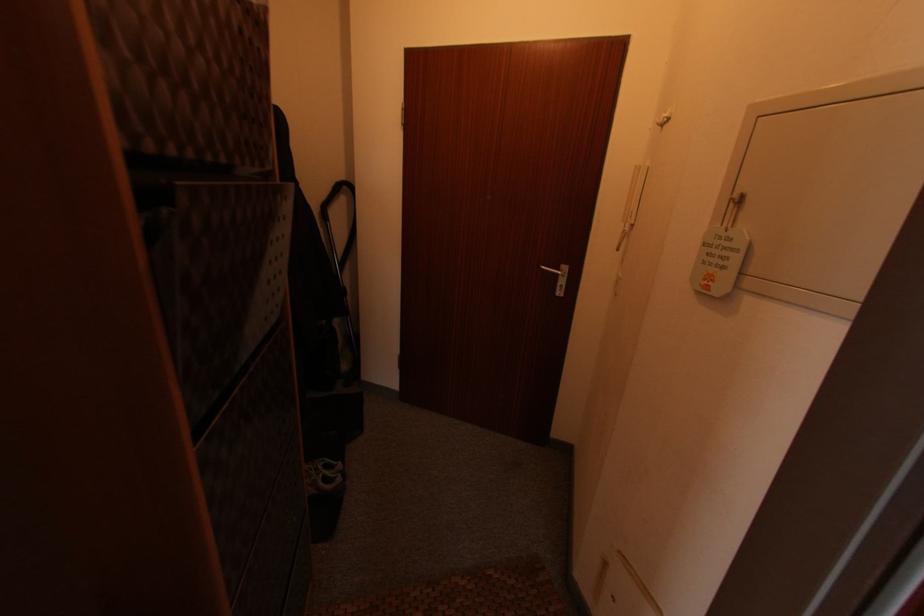
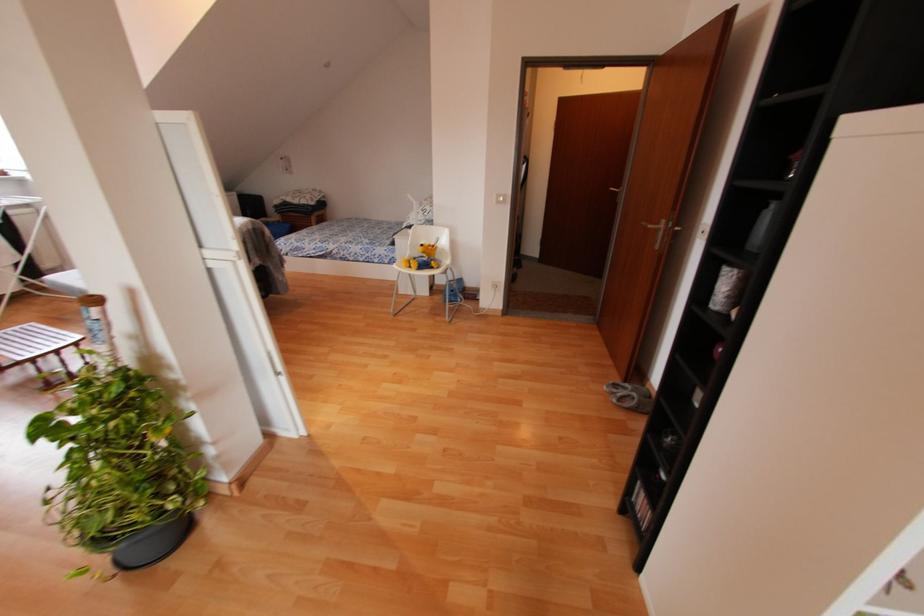
Question: In a continuous first-person perspective shot, in which direction is the camera moving?

Choices:
 (A) Left
 (B) Right
 (C) Forward
 (D) Backward

Answer: (D)